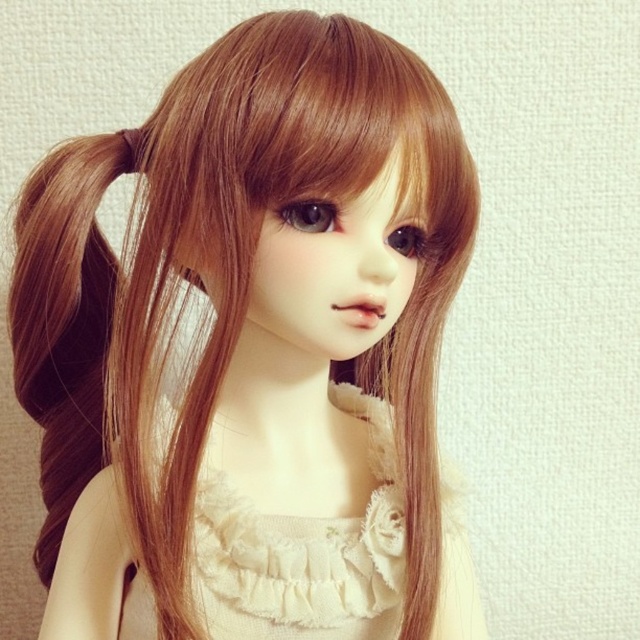
Locate an element on the screen. The image size is (640, 640). light beige lace dress at center is located at coordinates (305, 554).

Who is positioned more to the right, light beige lace dress at center or brown silky hair at left?

light beige lace dress at center

Identify the location of light beige lace dress at center. Image resolution: width=640 pixels, height=640 pixels. (305, 554).

The width and height of the screenshot is (640, 640). Identify the location of light beige lace dress at center. (305, 554).